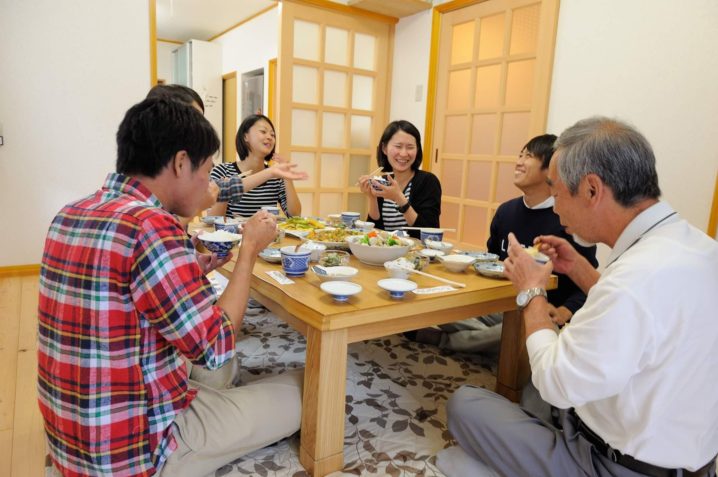
Image resolution: width=718 pixels, height=477 pixels. I want to click on bowl of salad, so point(377,251).